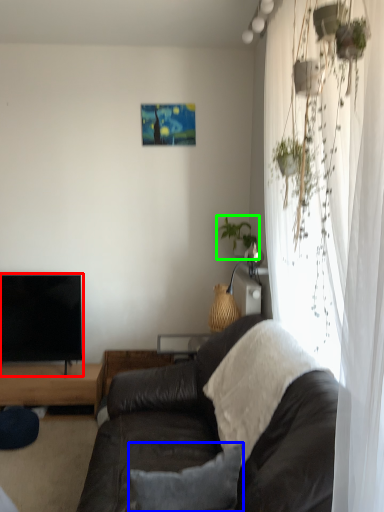
Question: Which object is the farthest from television (highlighted by a red box)? Choose among these: pillow (highlighted by a blue box) or houseplant (highlighted by a green box).

Choices:
 (A) pillow
 (B) houseplant

Answer: (A)